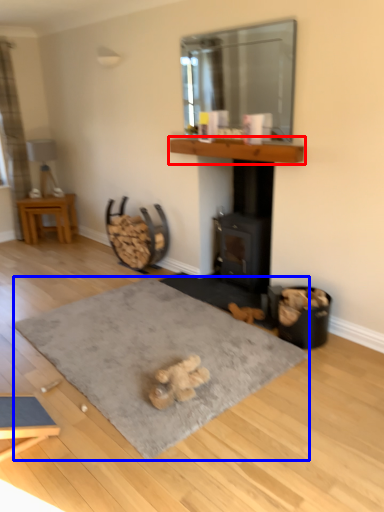
Question: Which object is closer to the camera taking this photo, mantle (highlighted by a red box) or yoga mat (highlighted by a blue box)?

Choices:
 (A) mantle
 (B) yoga mat

Answer: (B)